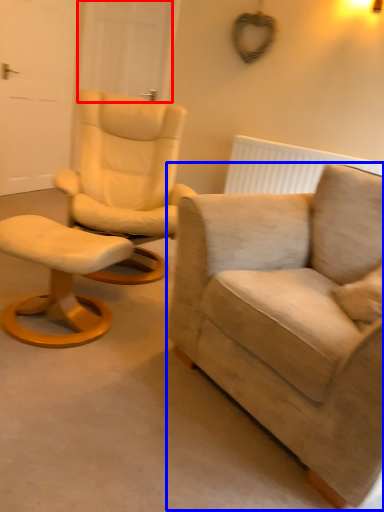
Question: Which object appears farthest to the camera in this image, door (highlighted by a red box) or chair (highlighted by a blue box)?

Choices:
 (A) door
 (B) chair

Answer: (A)